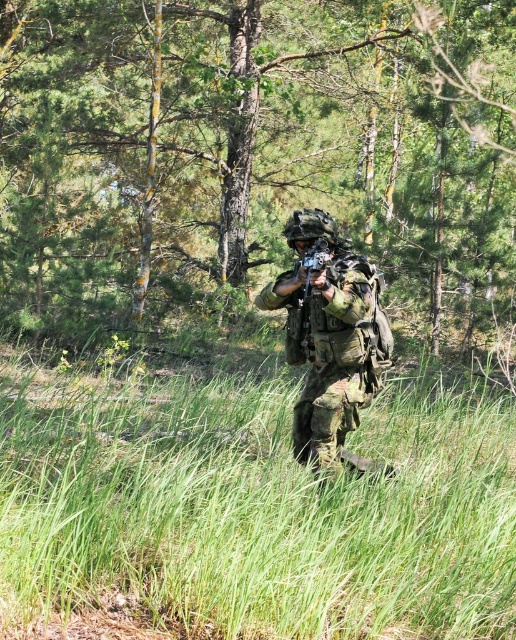
Who is lower down, green leafy tree at center or camouflage fabric uniform at center?

camouflage fabric uniform at center

Looking at this image, measure the distance between green leafy tree at center and camera.

They are 11.60 meters apart.

Find the location of `green leafy tree at center`. green leafy tree at center is located at coordinates (233, 157).

Is camouflage fabric uniform at center further to camera compared to matte black rifle at center?

No, camouflage fabric uniform at center is closer to the viewer.

From the picture: Does camouflage fabric uniform at center appear over matte black rifle at center?

No, camouflage fabric uniform at center is not above matte black rifle at center.

Locate an element on the screen. The width and height of the screenshot is (516, 640). camouflage fabric uniform at center is located at coordinates (330, 337).

I want to click on green leafy tree at center, so click(233, 157).

Is green leafy tree at center to the right of matte black rifle at center from the viewer's perspective?

In fact, green leafy tree at center is to the left of matte black rifle at center.

Is point (431, 346) farther from camera compared to point (309, 260)?

Yes, point (431, 346) is farther from viewer.

Where is `green leafy tree at center`? The height and width of the screenshot is (640, 516). green leafy tree at center is located at coordinates (233, 157).